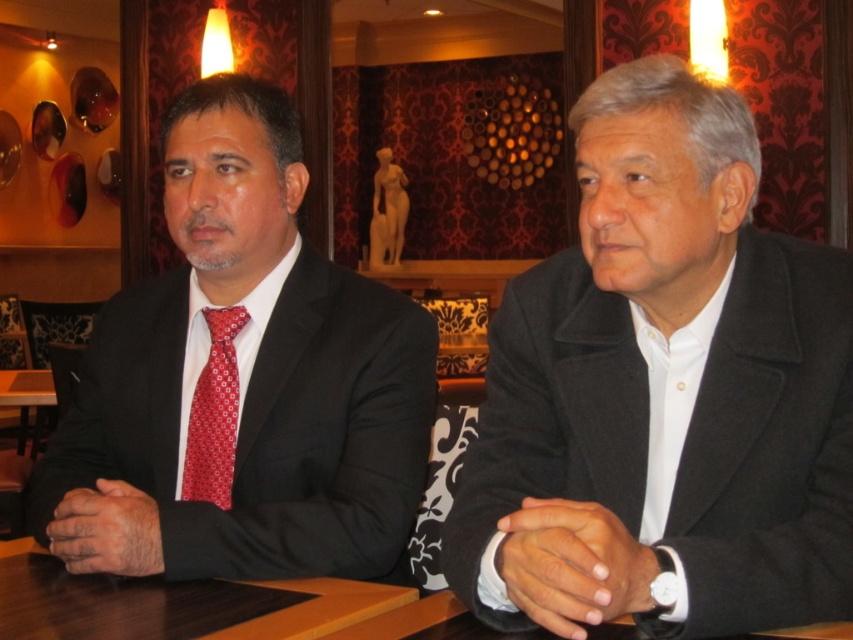
You are a guest at this event and need to place your 1.5 meter tall luggage on the floor next to the brown wooden table at center. Will the black wool coat at right block the space where you want to place your luggage?

The black wool coat at right is taller than the brown wooden table at center, so it may block the space where you want to place your luggage. Check the coat height before placing the luggage.

You are a guest at this formal event and need to retrieve your black wool coat at right. Based on its coordinates, which direction should you move to reach it?

The black wool coat at right is located at coordinates point (663, 392). To reach it, you should move towards the right side of the scene since the coat is positioned at the right side of the image.